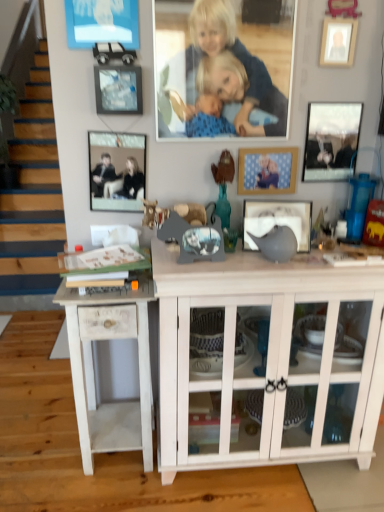
Question: Based on their positions, is metallic silver picture frame at upper left, which appears as the 5th picture frame when viewed from the right, located to the left or right of white wood side table at lower left?

Choices:
 (A) right
 (B) left

Answer: (A)

Question: Is metallic silver picture frame at upper left, which appears as the 5th picture frame when viewed from the right, wider or thinner than white wood side table at lower left?

Choices:
 (A) thin
 (B) wide

Answer: (A)

Question: Considering the real-world distances, which object is closest to the white wood cabinet at center?

Choices:
 (A) blue fabric blanket at upper center
 (B) wooden picture frame at upper right, which appears as the 5th picture frame when viewed from the left
 (C) metallic silver picture frame at upper left, which appears as the 5th picture frame when viewed from the right
 (D) metallic silver picture frame at upper right, the sixth picture frame positioned from the left
 (E) matte black picture frame at center, the fourth picture frame in the left-to-right sequence

Answer: (E)

Question: Based on their relative distances, which object is farther from the white wood side table at lower left?

Choices:
 (A) metallic silver picture frame at upper left, the sixth picture frame from the right
 (B) metallic silver picture frame at upper right, arranged as the 1th picture frame when viewed from the right
 (C) wooden picture frame at upper right, which appears as the 2th picture frame when viewed from the right
 (D) white wood cabinet at center
 (E) matte black picture frame at center, the fourth picture frame in the left-to-right sequence

Answer: (C)